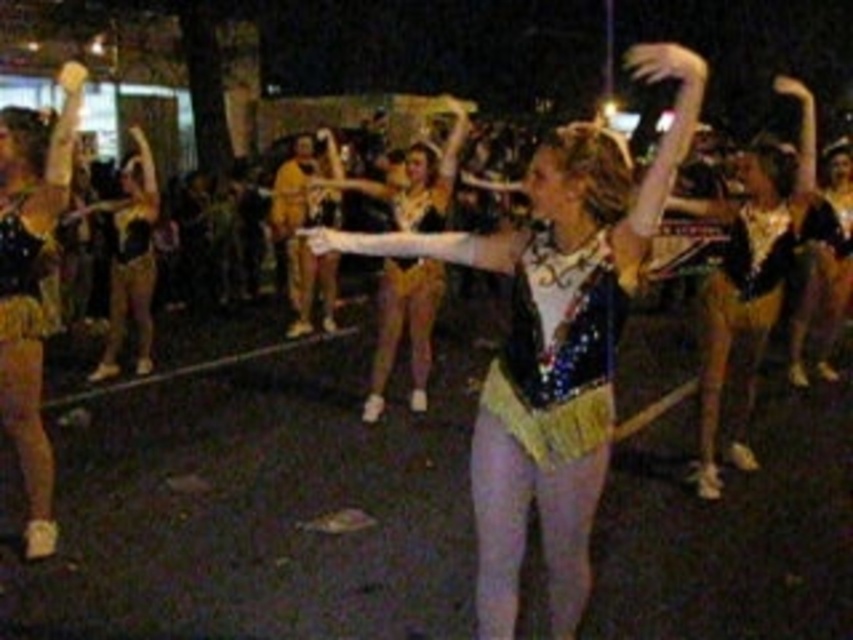
Does sparkly sequined leotard at center have a lesser height compared to shiny gold shorts at left?

Yes, sparkly sequined leotard at center is shorter than shiny gold shorts at left.

Is sparkly sequined leotard at center taller than shiny gold shorts at left?

No, sparkly sequined leotard at center is not taller than shiny gold shorts at left.

Describe the element at coordinates (554, 339) in the screenshot. I see `sparkly sequined leotard at center` at that location.

Where is `sparkly sequined leotard at center`? This screenshot has width=853, height=640. sparkly sequined leotard at center is located at coordinates (554, 339).

Can you confirm if shiny gold shorts at left is positioned below sparkly sequined top at center?

Correct, shiny gold shorts at left is located below sparkly sequined top at center.

Locate an element on the screen. This screenshot has width=853, height=640. shiny gold shorts at left is located at coordinates (32, 284).

Is point (56, 184) positioned behind point (397, 282)?

No.

What are the coordinates of `shiny gold shorts at left` in the screenshot? It's located at (32, 284).

Who is taller, sparkly sequined leotard at center or sparkly sequined top at center?

With more height is sparkly sequined leotard at center.

What do you see at coordinates (554, 339) in the screenshot? This screenshot has height=640, width=853. I see `sparkly sequined leotard at center` at bounding box center [554, 339].

Describe the element at coordinates (554, 339) in the screenshot. This screenshot has height=640, width=853. I see `sparkly sequined leotard at center` at that location.

This screenshot has width=853, height=640. Identify the location of sparkly sequined leotard at center. (554, 339).